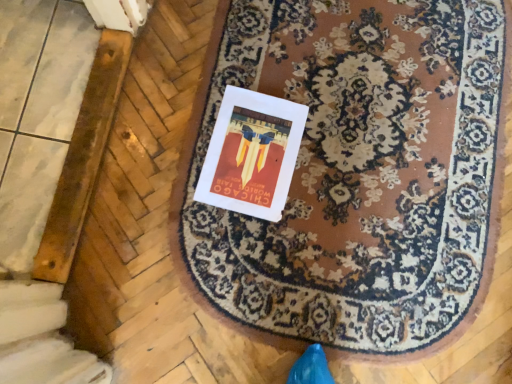
Locate an element on the screen. This screenshot has height=384, width=512. white paper at center is located at coordinates (252, 154).

This screenshot has height=384, width=512. What do you see at coordinates (252, 154) in the screenshot? I see `white paper at center` at bounding box center [252, 154].

Describe the element at coordinates (356, 173) in the screenshot. I see `brown woolen mat at center` at that location.

This screenshot has height=384, width=512. I want to click on brown woolen mat at center, so click(x=356, y=173).

Find the location of a particular element. This screenshot has height=384, width=512. white paper at center is located at coordinates (252, 154).

Considering the relative positions of brown woolen mat at center and white paper at center in the image provided, is brown woolen mat at center to the right of white paper at center from the viewer's perspective?

Yes, brown woolen mat at center is to the right of white paper at center.

Which is behind, brown woolen mat at center or white paper at center?

Positioned behind is white paper at center.

Considering the points (413, 313) and (293, 139), which point is in front, point (413, 313) or point (293, 139)?

The point (413, 313) is closer.

From the image's perspective, which object appears higher, brown woolen mat at center or white paper at center?

white paper at center.

From a real-world perspective, who is located higher, brown woolen mat at center or white paper at center?

From a 3D spatial view, white paper at center is above.

Looking at their sizes, would you say brown woolen mat at center is wider or thinner than white paper at center?

In the image, brown woolen mat at center appears to be wider than white paper at center.

Between brown woolen mat at center and white paper at center, which one has less height?

white paper at center.

Is brown woolen mat at center bigger than white paper at center?

Indeed, brown woolen mat at center has a larger size compared to white paper at center.

Would you say brown woolen mat at center is outside white paper at center?

Yes, brown woolen mat at center is located beyond the bounds of white paper at center.

Is brown woolen mat at center positioned far away from white paper at center?

That's not correct — brown woolen mat at center is a little close to white paper at center.

Is brown woolen mat at center turned away from white paper at center?

No.

Can you tell me how much brown woolen mat at center and white paper at center differ in facing direction?

brown woolen mat at center and white paper at center are facing 3.72 degrees away from each other.

How far apart are brown woolen mat at center and white paper at center?

A distance of 7.00 inches exists between brown woolen mat at center and white paper at center.

This screenshot has height=384, width=512. I want to click on postcard behind the brown woolen mat at center, so click(252, 154).

Is white paper at center at the left side of brown woolen mat at center?

Yes.

Is white paper at center positioned in front of brown woolen mat at center?

No, it is behind brown woolen mat at center.

Between point (263, 196) and point (343, 53), which one is positioned in front?

The point (263, 196) is closer to the camera.

From the image's perspective, is white paper at center positioned above or below brown woolen mat at center?

white paper at center is above brown woolen mat at center.

From a real-world perspective, is white paper at center beneath brown woolen mat at center?

No, from a real-world perspective, white paper at center is not beneath brown woolen mat at center.

Does white paper at center have a greater width compared to brown woolen mat at center?

In fact, white paper at center might be narrower than brown woolen mat at center.

Considering the relative sizes of white paper at center and brown woolen mat at center in the image provided, is white paper at center shorter than brown woolen mat at center?

Yes, white paper at center is shorter than brown woolen mat at center.

Considering the sizes of objects white paper at center and brown woolen mat at center in the image provided, who is bigger, white paper at center or brown woolen mat at center?

With larger size is brown woolen mat at center.

Could brown woolen mat at center be considered to be inside white paper at center?

No, brown woolen mat at center is not a part of white paper at center.

Does white paper at center touch brown woolen mat at center?

white paper at center is not next to brown woolen mat at center, and they're not touching.

Is white paper at center aimed at brown woolen mat at center?

Yes, white paper at center is oriented towards brown woolen mat at center.

Find the location of a particular element. postcard on the left of brown woolen mat at center is located at coordinates (252, 154).

In order to click on mat that appears on the right of white paper at center in this screenshot , I will do `click(356, 173)`.

Locate an element on the screen. This screenshot has width=512, height=384. mat that appears below the white paper at center (from a real-world perspective) is located at coordinates (356, 173).